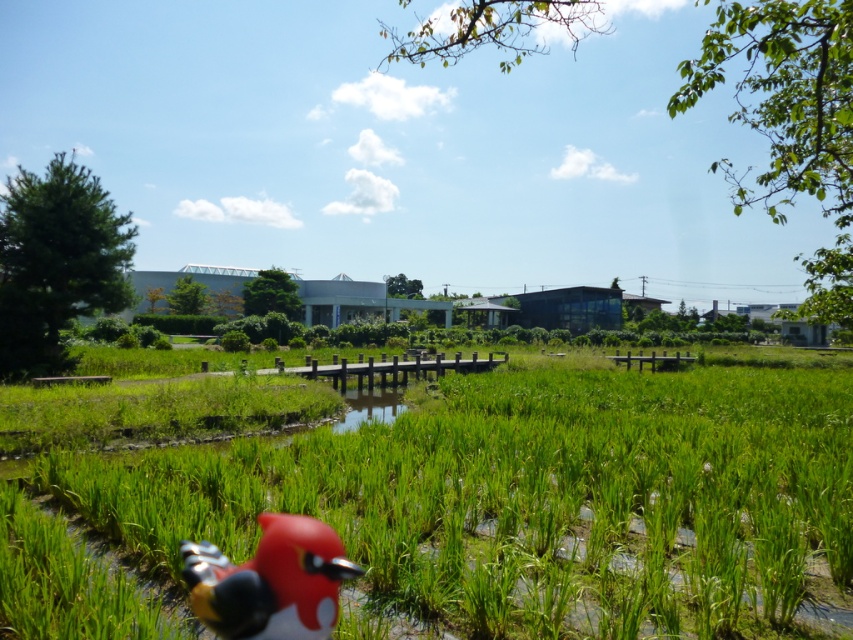
Who is higher up, green grass at center or rubberized red bird at lower left?

rubberized red bird at lower left is higher up.

Is green grass at center positioned behind rubberized red bird at lower left?

Yes, it is behind rubberized red bird at lower left.

Is point (589, 410) closer to viewer compared to point (312, 600)?

No, (589, 410) is further to viewer.

Locate an element on the screen. Image resolution: width=853 pixels, height=640 pixels. green grass at center is located at coordinates (535, 500).